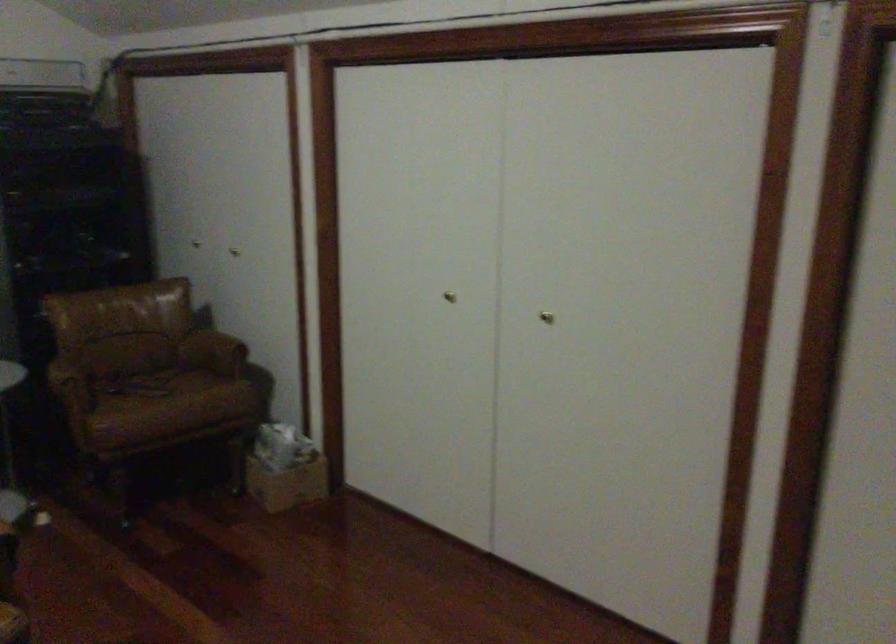
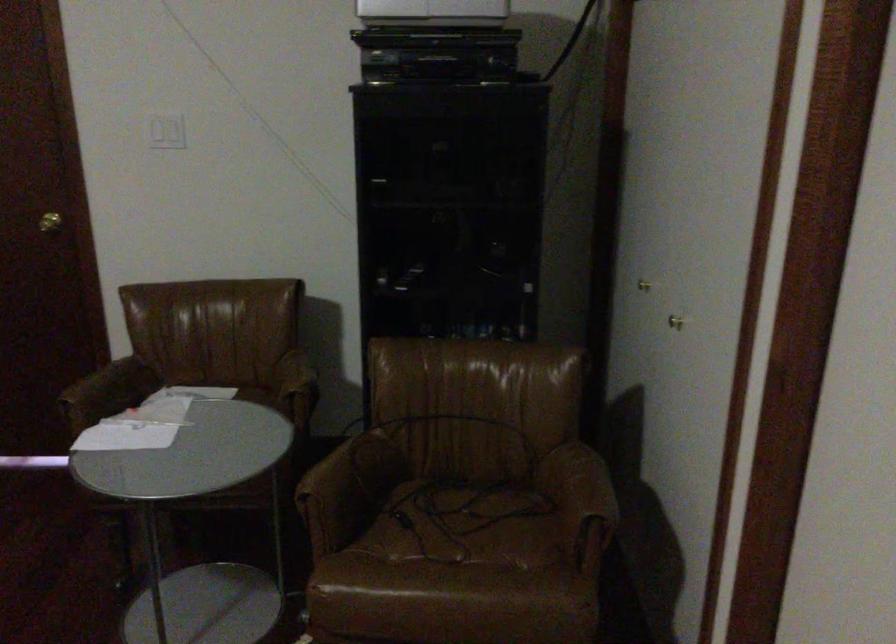
The point at (153, 383) is marked in the first image. Where is the corresponding point in the second image?

(464, 525)